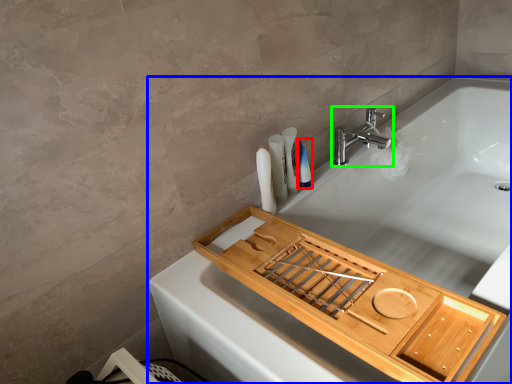
Question: Considering the real-world distances, which object is farthest from toiletry (highlighted by a red box)? bathtub (highlighted by a blue box) or tap (highlighted by a green box)?

Choices:
 (A) bathtub
 (B) tap

Answer: (A)